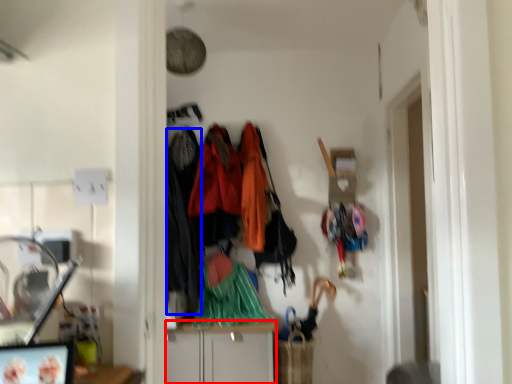
Question: Which object appears farthest to the camera in this image, cabinetry (highlighted by a red box) or clothing (highlighted by a blue box)?

Choices:
 (A) cabinetry
 (B) clothing

Answer: (B)